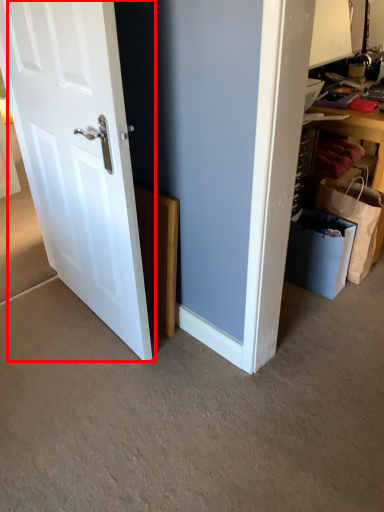
Question: Considering the relative positions of door (annotated by the red box) and shopping bag in the image provided, where is door (annotated by the red box) located with respect to the staircase?

Choices:
 (A) right
 (B) left

Answer: (B)